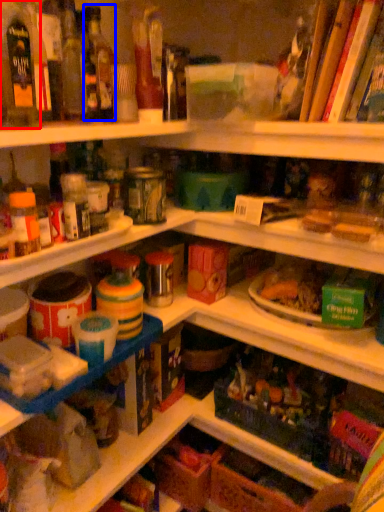
Question: Which point is closer to the camera, bottle (highlighted by a red box) or bottle (highlighted by a blue box)?

Choices:
 (A) bottle
 (B) bottle

Answer: (A)